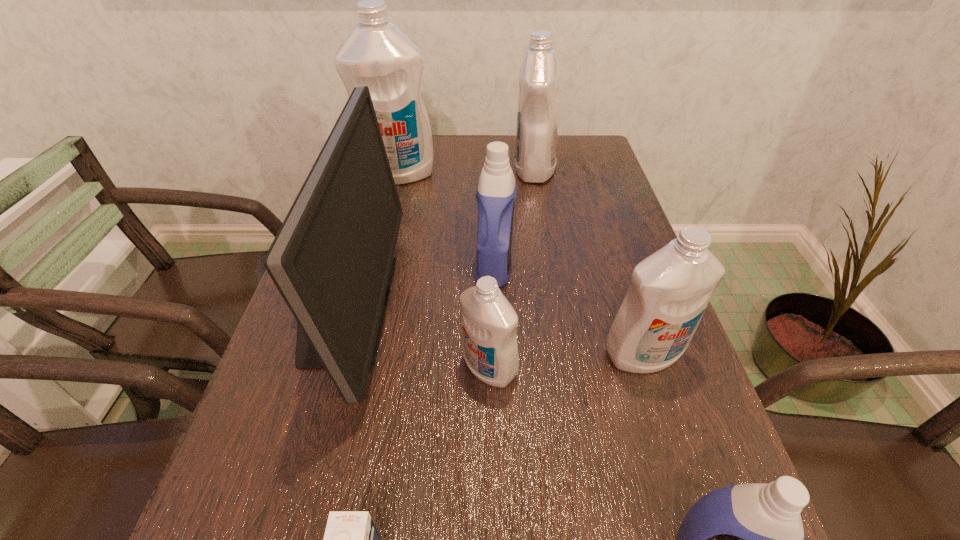
I want to click on free space at the left edge of the desktop, so click(x=297, y=451).

The height and width of the screenshot is (540, 960). What are the coordinates of `vacant space at the right edge of the desktop` in the screenshot? It's located at (590, 202).

Where is `free space between the smallest white detergent and the black computer monitor`? free space between the smallest white detergent and the black computer monitor is located at coordinates (418, 337).

Find the location of a particular element. free spot between the biggest white detergent and the third white detergent from left to right is located at coordinates [x=467, y=172].

Identify the location of free space between the smallest white detergent and the leftmost detergent. (444, 271).

Image resolution: width=960 pixels, height=540 pixels. What are the coordinates of `object that stands as the closest to the black computer monitor` in the screenshot? It's located at (489, 322).

Locate an element on the screen. The height and width of the screenshot is (540, 960). object that is the fourth nearest to the second smallest white detergent is located at coordinates (332, 260).

Image resolution: width=960 pixels, height=540 pixels. I want to click on detergent that is the closest one to the bigger blue detergent, so click(489, 322).

Identify the location of detergent that is the fourth closest to the smallest white detergent. The image size is (960, 540). (539, 78).

The height and width of the screenshot is (540, 960). I want to click on the second closest white detergent to the second white detergent from left to right, so click(539, 78).